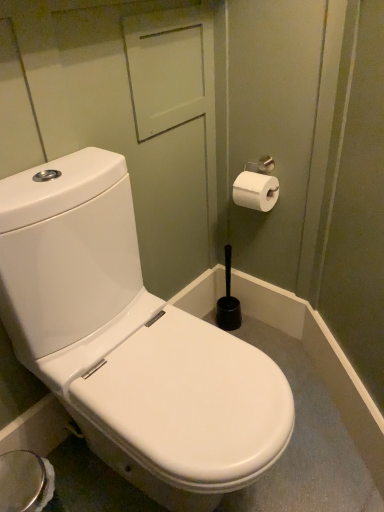
Find the location of a particular element. white matte toilet paper at upper right is located at coordinates (255, 191).

Describe the element at coordinates (255, 191) in the screenshot. I see `white matte toilet paper at upper right` at that location.

Where is `white glossy toilet at center`? white glossy toilet at center is located at coordinates (130, 341).

Describe the element at coordinates (130, 341) in the screenshot. I see `white glossy toilet at center` at that location.

The image size is (384, 512). What are the coordinates of `white matte toilet paper at upper right` in the screenshot? It's located at (255, 191).

Is white matte toilet paper at upper right at the right side of white glossy toilet at center?

Correct, you'll find white matte toilet paper at upper right to the right of white glossy toilet at center.

Which is in front, white matte toilet paper at upper right or white glossy toilet at center?

white glossy toilet at center is in front.

Is point (243, 181) closer or farther from the camera than point (85, 149)?

Point (243, 181).

From the image's perspective, does white matte toilet paper at upper right appear higher than white glossy toilet at center?

Yes, from the image's perspective, white matte toilet paper at upper right is over white glossy toilet at center.

From a real-world perspective, who is located lower, white matte toilet paper at upper right or white glossy toilet at center?

white glossy toilet at center, from a real-world perspective.

Can you confirm if white matte toilet paper at upper right is wider than white glossy toilet at center?

No, white matte toilet paper at upper right is not wider than white glossy toilet at center.

Based on the photo, does white matte toilet paper at upper right have a greater height compared to white glossy toilet at center?

No.

Between white matte toilet paper at upper right and white glossy toilet at center, which one has smaller size?

white matte toilet paper at upper right is smaller.

Is white glossy toilet at center inside white matte toilet paper at upper right?

No, white glossy toilet at center is not inside white matte toilet paper at upper right.

Are white matte toilet paper at upper right and white glossy toilet at center making contact?

white matte toilet paper at upper right and white glossy toilet at center are not in contact.

Is white matte toilet paper at upper right facing away from white glossy toilet at center?

No, white glossy toilet at center is not at the back of white matte toilet paper at upper right.

Can you tell me how much white matte toilet paper at upper right and white glossy toilet at center differ in facing direction?

They differ by 89.5 degrees in their facing directions.

In order to click on toilet paper that is on the right side of white glossy toilet at center in this screenshot , I will do `click(255, 191)`.

Is white glossy toilet at center to the left or to the right of white matte toilet paper at upper right in the image?

Based on their positions, white glossy toilet at center is located to the left of white matte toilet paper at upper right.

Is the position of white glossy toilet at center more distant than that of white matte toilet paper at upper right?

No, white glossy toilet at center is in front of white matte toilet paper at upper right.

Looking at this image, which point is more distant from viewer, (x=152, y=367) or (x=267, y=194)?

The point (x=267, y=194) is more distant.

From the image's perspective, is white glossy toilet at center located above or below white matte toilet paper at upper right?

Based on their image positions, white glossy toilet at center is located beneath white matte toilet paper at upper right.

From a real-world perspective, who is located lower, white glossy toilet at center or white matte toilet paper at upper right?

white glossy toilet at center.

Is white glossy toilet at center wider or thinner than white matte toilet paper at upper right?

Considering their sizes, white glossy toilet at center looks broader than white matte toilet paper at upper right.

Considering the relative sizes of white glossy toilet at center and white matte toilet paper at upper right in the image provided, is white glossy toilet at center taller than white matte toilet paper at upper right?

Correct, white glossy toilet at center is much taller as white matte toilet paper at upper right.

Considering the sizes of white glossy toilet at center and white matte toilet paper at upper right in the image, is white glossy toilet at center bigger or smaller than white matte toilet paper at upper right?

Clearly, white glossy toilet at center is larger in size than white matte toilet paper at upper right.

Based on the photo, can we say white glossy toilet at center lies outside white matte toilet paper at upper right?

Yes.

Is white glossy toilet at center with white matte toilet paper at upper right?

There is a gap between white glossy toilet at center and white matte toilet paper at upper right.

Is white glossy toilet at center facing away from white matte toilet paper at upper right?

That's not correct — white glossy toilet at center is not looking away from white matte toilet paper at upper right.

How distant is white glossy toilet at center from white matte toilet paper at upper right?

A distance of 24.31 inches exists between white glossy toilet at center and white matte toilet paper at upper right.

Image resolution: width=384 pixels, height=512 pixels. What are the coordinates of `toilet paper positioned vertically above the white glossy toilet at center (from a real-world perspective)` in the screenshot? It's located at (255, 191).

Find the location of a particular element. The height and width of the screenshot is (512, 384). toilet paper that is above the white glossy toilet at center (from the image's perspective) is located at coordinates (255, 191).

Locate an element on the screen. toilet paper behind the white glossy toilet at center is located at coordinates (255, 191).